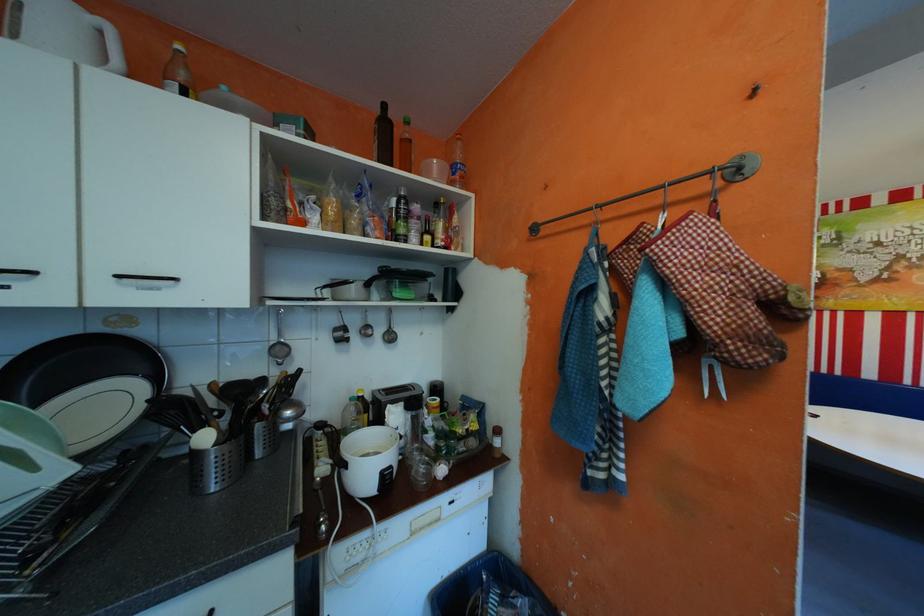
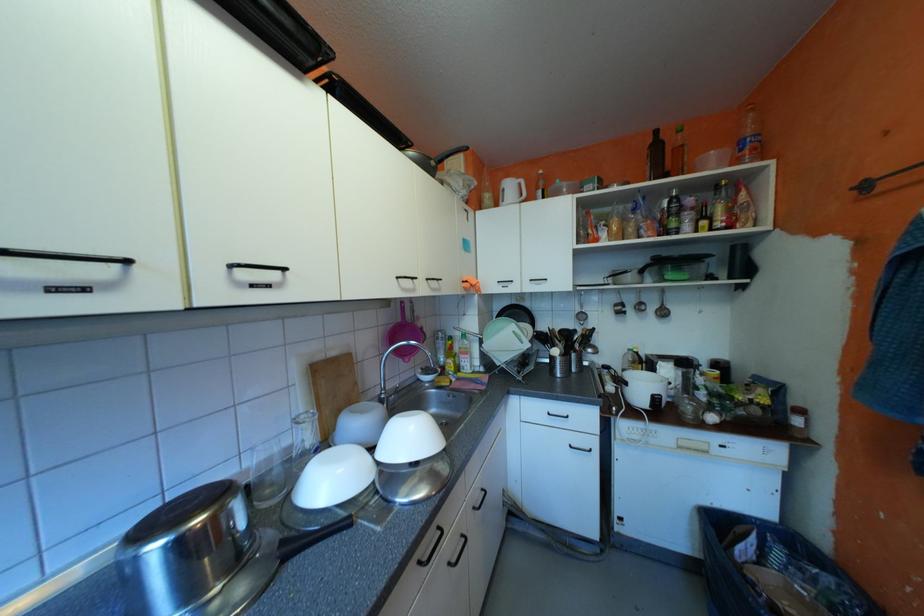
Question: How did the camera likely rotate?

Choices:
 (A) Left
 (B) Right
 (C) Up
 (D) Down

Answer: (A)